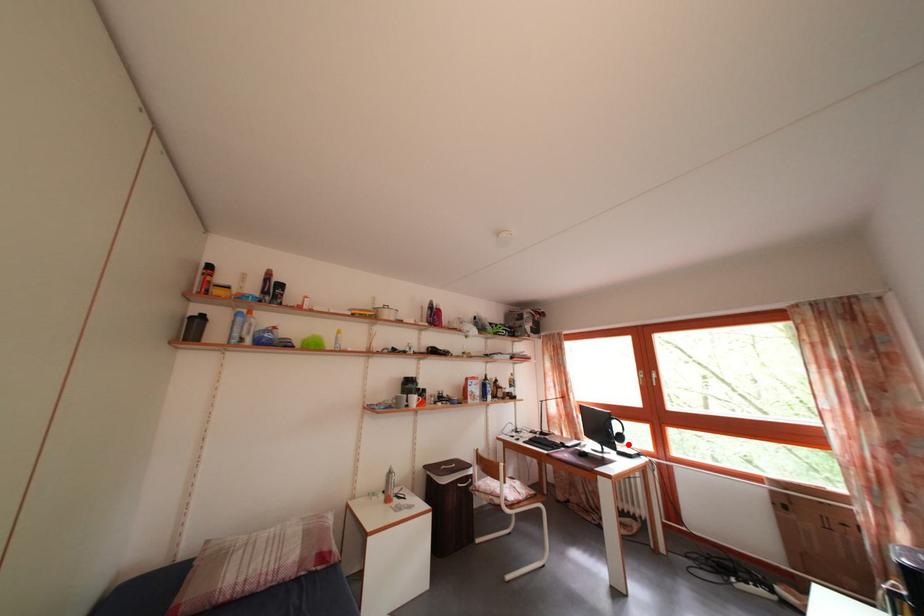
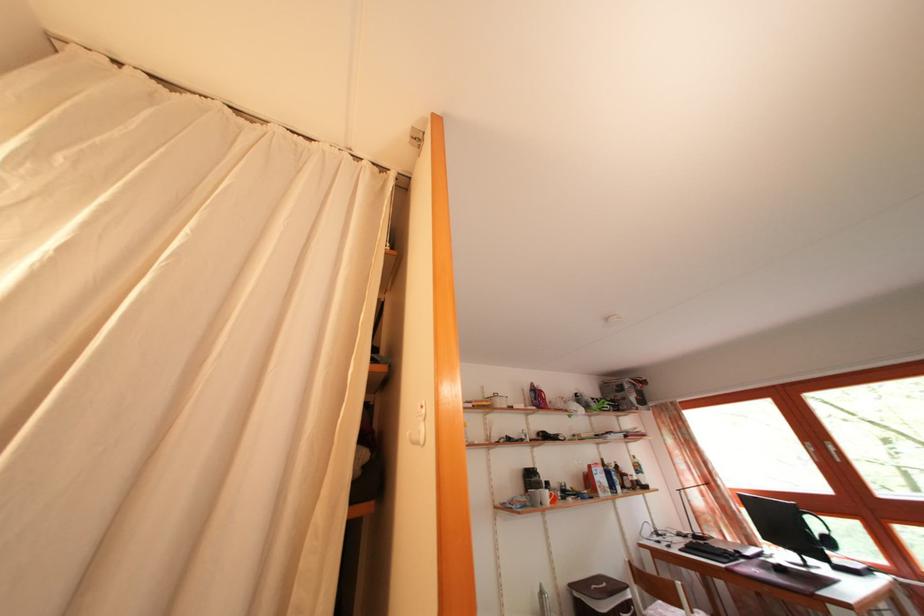
Question: I am providing you with two images of the same scene from different viewpoints. A red point is shown in image1. For the corresponding object point in image2, is it positioned nearer or farther from the camera?

Choices:
 (A) Nearer
 (B) Farther

Answer: (A)